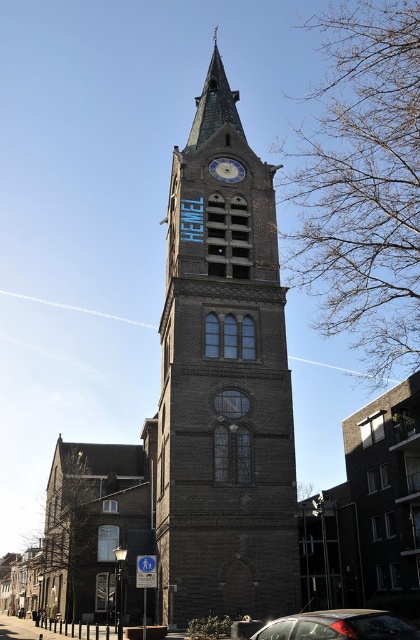
You are standing in front of the church tower. You notice the dark brown stone tower at center and the blue stone clock at center. Which one is positioned to the left?

The dark brown stone tower at center is positioned to the left of the blue stone clock at center.

You are standing at the base of the dark brown stone tower at center and want to place a new decorative plaque on the tower. The plaque requires a minimum of 150 feet of space between it and the nearest arched window to ensure visibility. Is the available space sufficient?

The plaque requires a minimum of 150 feet of space between it and the nearest arched window, but the available space is only 143.99 feet. Therefore, the space is insufficient for the plaque.

You are standing in front of the church tower and want to know the position of the blue stone clock at center relative to the dark brown stone tower at center. Is the clock above or below the tower?

The dark brown stone tower at center is above the blue stone clock at center, so the clock is below the tower.